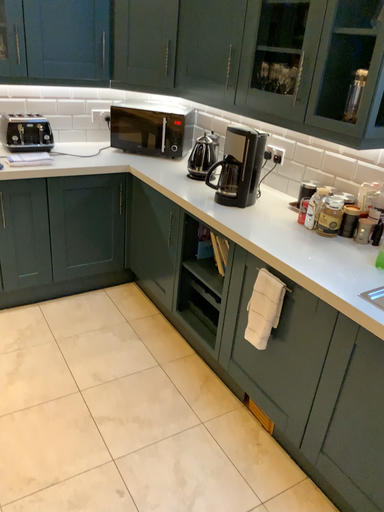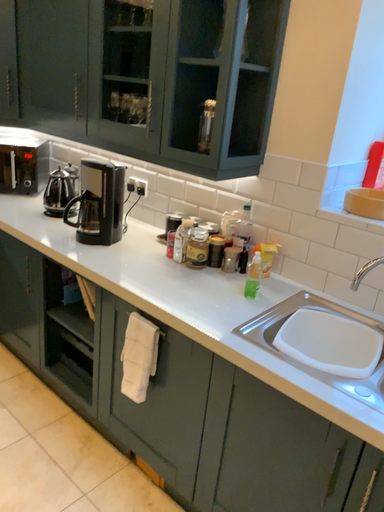
Question: Which way did the camera rotate in the video?

Choices:
 (A) rotated left
 (B) rotated right

Answer: (B)